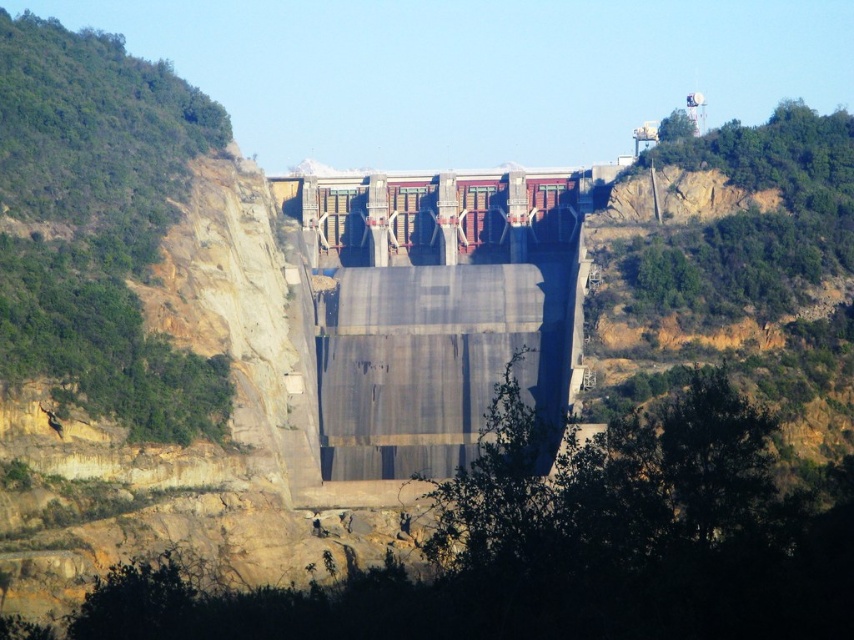
Question: Which point is closer to the camera?

Choices:
 (A) (407, 298)
 (B) (337, 243)

Answer: (A)

Question: Among these objects, which one is nearest to the camera?

Choices:
 (A) smooth concrete dam at center
 (B) gray concrete dam at center

Answer: (B)

Question: Considering the relative positions of gray concrete dam at center and smooth concrete dam at center in the image provided, where is gray concrete dam at center located with respect to smooth concrete dam at center?

Choices:
 (A) above
 (B) below

Answer: (B)

Question: Does gray concrete dam at center appear on the right side of smooth concrete dam at center?

Choices:
 (A) no
 (B) yes

Answer: (B)

Question: Can you confirm if gray concrete dam at center is positioned below smooth concrete dam at center?

Choices:
 (A) no
 (B) yes

Answer: (B)